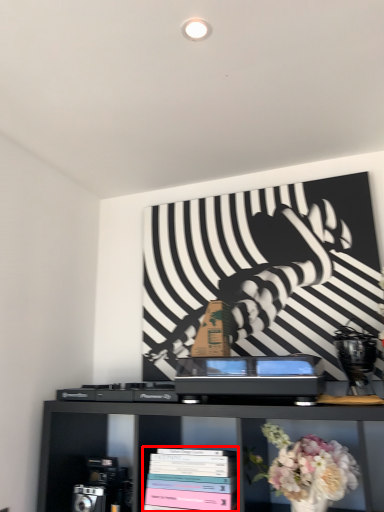
Question: From the image's perspective, what is the correct spatial positioning of book (annotated by the red box) in reference to flower?

Choices:
 (A) below
 (B) above

Answer: (A)